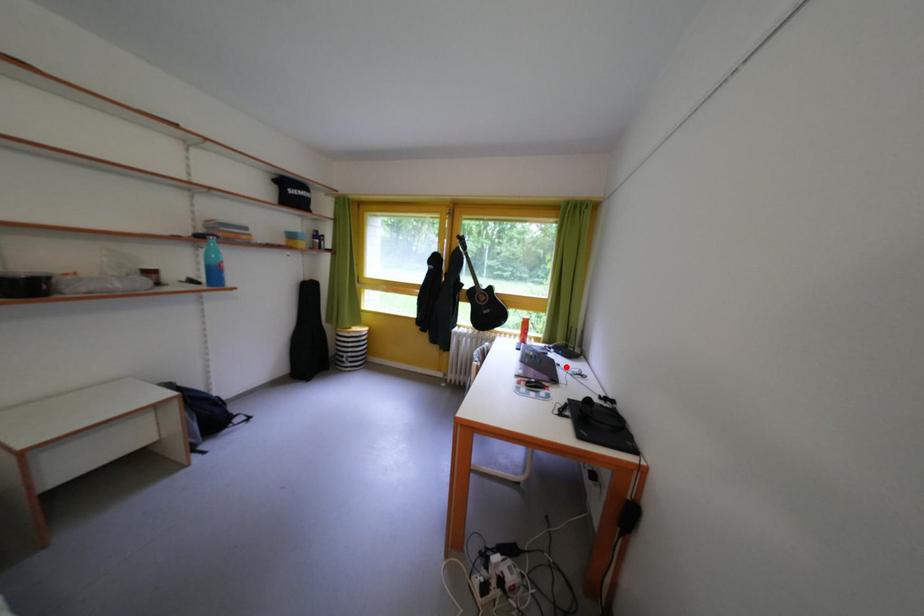
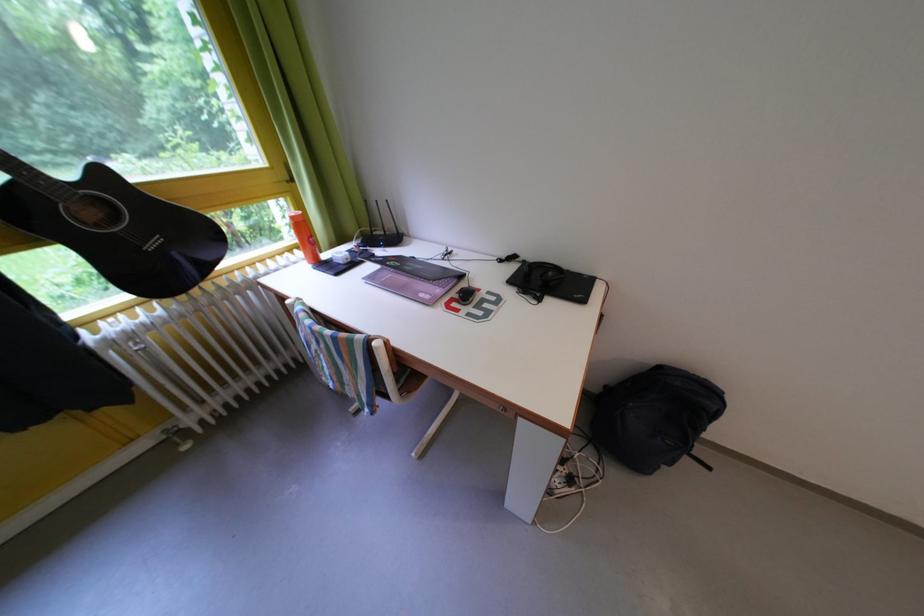
In the second image, find the point that corresponds to the highlighted location in the first image.

(417, 261)